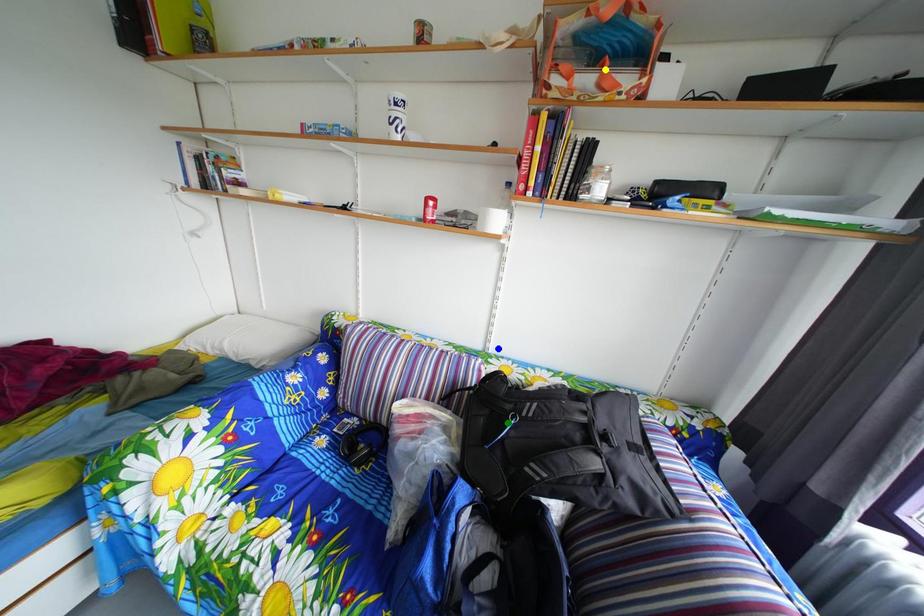
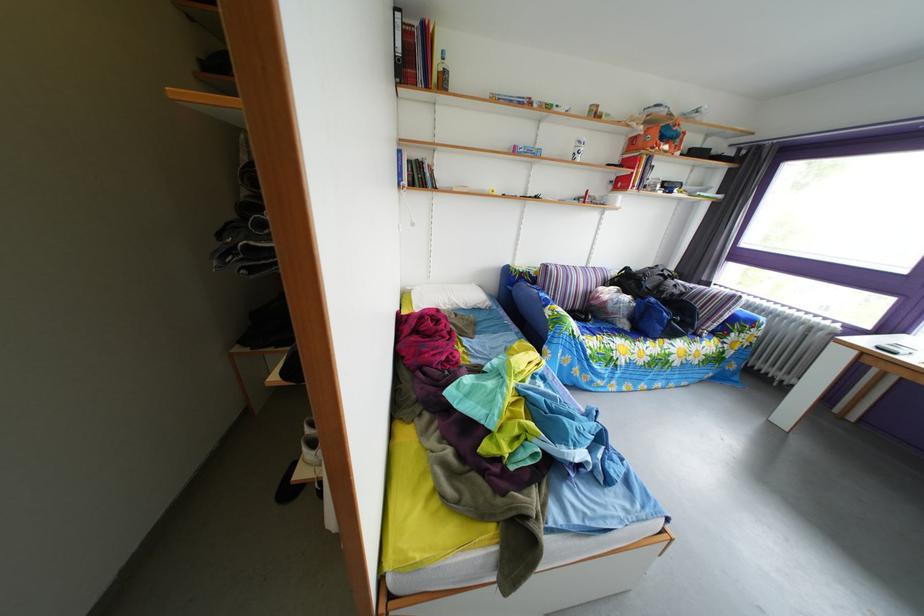
I am providing you with two images of the same scene from different viewpoints. Three points are marked in image1. Which point corresponds to a part or object that is occluded in image2?In image1, three points are marked. Which of them correspond to a part or object that is occluded in image2?Among the three points shown in image1, which one corresponds to a part or object that is no longer visible due to occlusion in image2?

green point cannot be seen in image2.